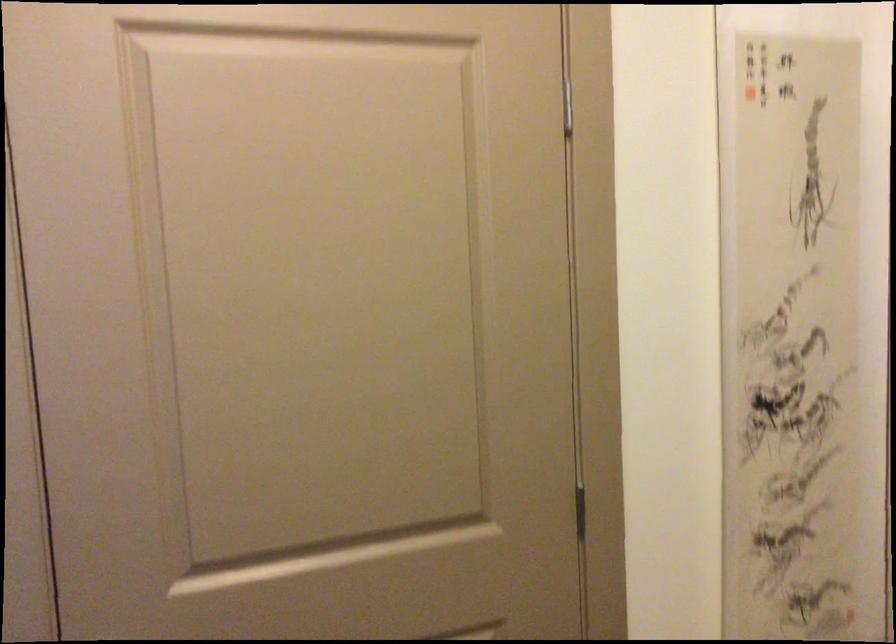
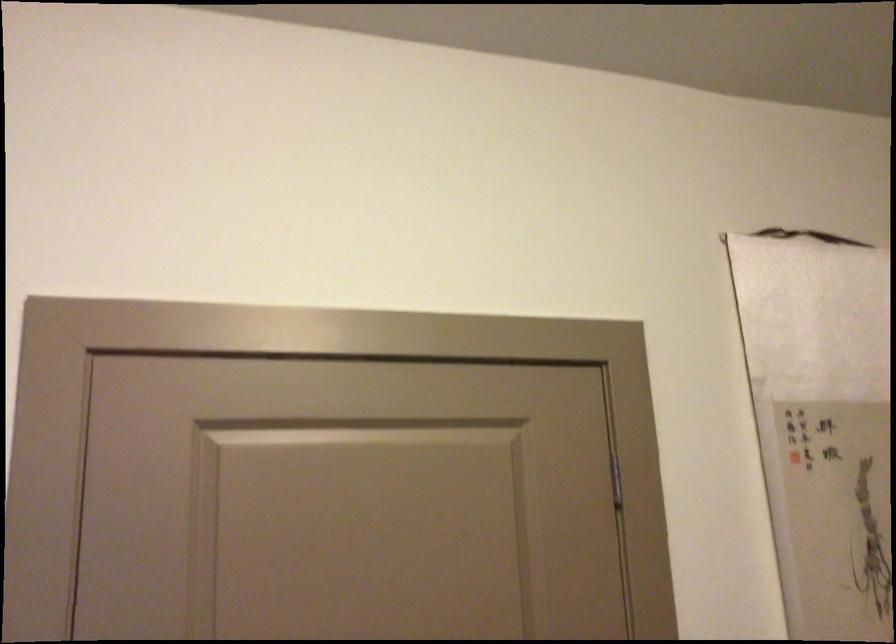
Question: The first image is from the beginning of the video and the second image is from the end. How did the camera likely rotate when shooting the video?

Choices:
 (A) Left
 (B) Right
 (C) Up
 (D) Down

Answer: (C)